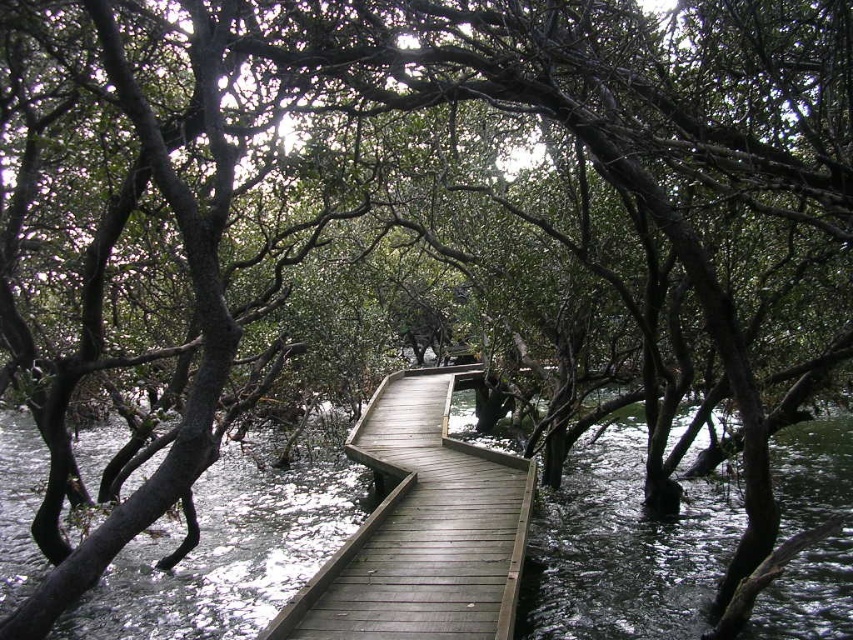
Question: Does greenish-brown wood at center appear on the left side of wooden walkway at center?

Choices:
 (A) no
 (B) yes

Answer: (B)

Question: Is greenish-brown wood at center wider than wooden walkway at center?

Choices:
 (A) no
 (B) yes

Answer: (B)

Question: Is greenish-brown wood at center to the left of wooden walkway at center from the viewer's perspective?

Choices:
 (A) yes
 (B) no

Answer: (A)

Question: Which point is farther from the camera taking this photo?

Choices:
 (A) (363, 426)
 (B) (401, 397)

Answer: (B)